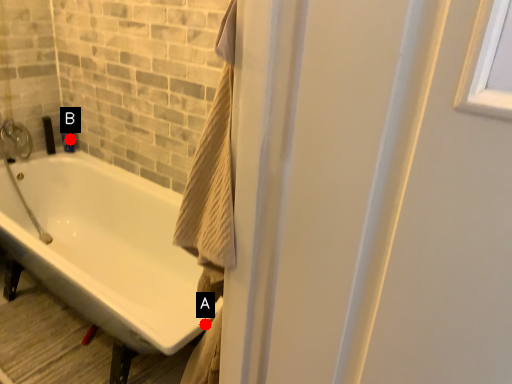
Question: Two points are circled on the image, labeled by A and B beside each circle. Which point is further to the camera?

Choices:
 (A) A is further
 (B) B is further

Answer: (B)